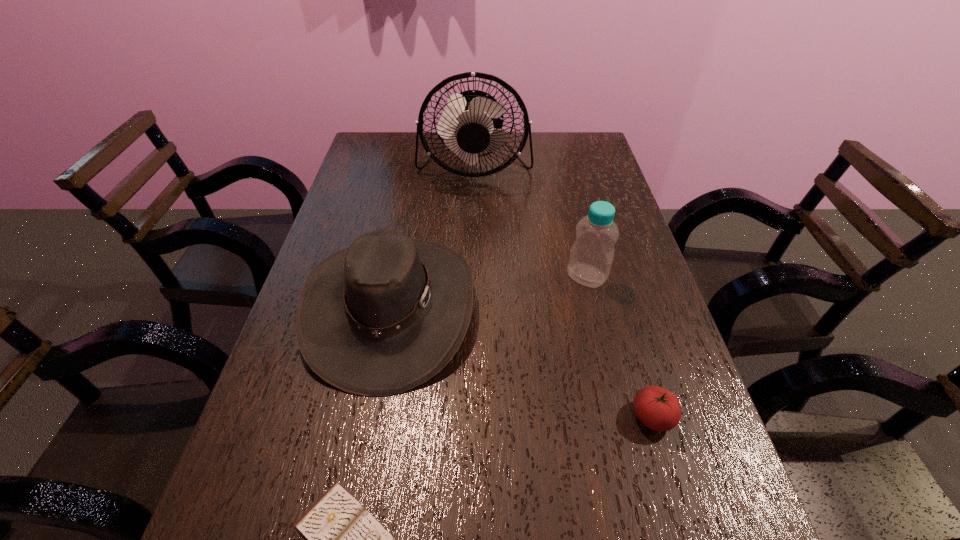
Identify the location of the farthest object. The image size is (960, 540). (467, 124).

Identify the location of fan. (467, 124).

I want to click on the fourth shortest object, so click(x=591, y=256).

Where is `cowboy hat`? This screenshot has height=540, width=960. cowboy hat is located at coordinates (379, 318).

The image size is (960, 540). What are the coordinates of `tomato` in the screenshot? It's located at (657, 408).

Locate an element on the screen. The image size is (960, 540). the fourth farthest object is located at coordinates (657, 408).

Locate an element on the screen. free location located 0.090m in front of the farthest object, directing airflow is located at coordinates (473, 210).

Locate an element on the screen. The height and width of the screenshot is (540, 960). blank space located 0.090m on the left of the second tallest object is located at coordinates (530, 276).

Find the location of `vacant point located 0.200m on the front-facing side of the third shortest object`. vacant point located 0.200m on the front-facing side of the third shortest object is located at coordinates (562, 308).

Image resolution: width=960 pixels, height=540 pixels. I want to click on vacant space located 0.180m on the back of the tomato, so click(x=625, y=323).